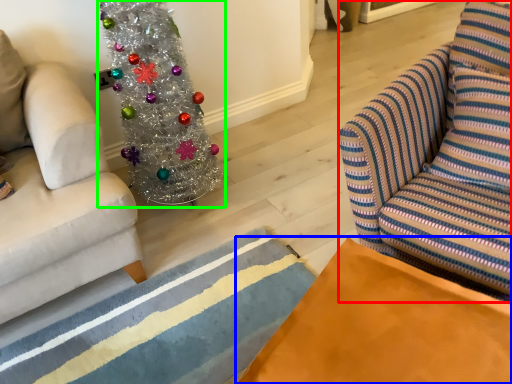
Question: Considering the real-world distances, which object is closest to swivel chair (highlighted by a red box)? table (highlighted by a blue box) or christmas tree (highlighted by a green box).

Choices:
 (A) table
 (B) christmas tree

Answer: (A)